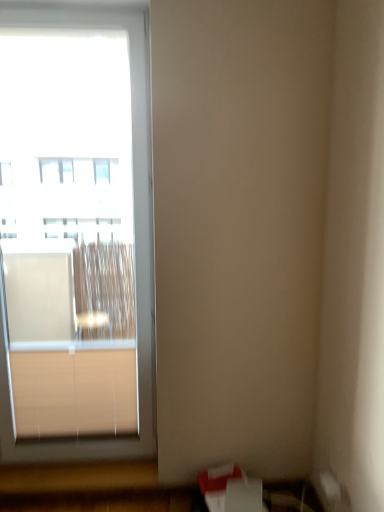
Image resolution: width=384 pixels, height=512 pixels. Identify the location of vacant space situated above white matte window at upper left (from a real-world perspective). (55, 7).